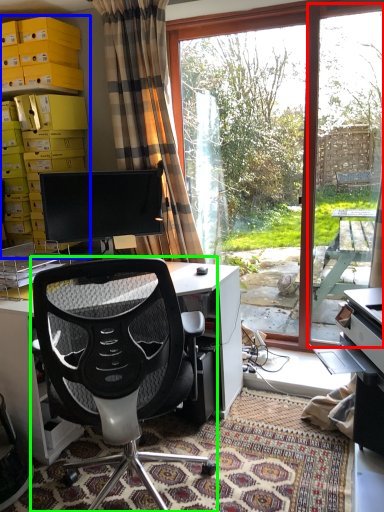
Question: Considering the real-world distances, which object is closest to screen door (highlighted by a red box)? shelf (highlighted by a blue box) or chair (highlighted by a green box).

Choices:
 (A) shelf
 (B) chair

Answer: (A)